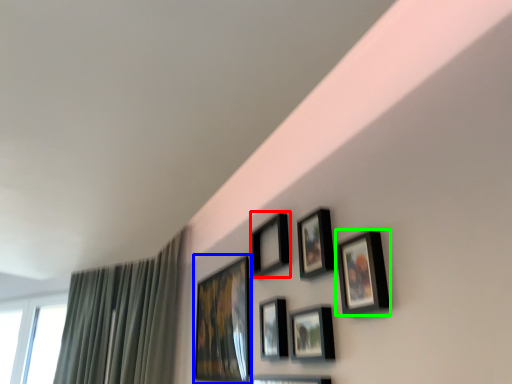
Question: Considering the real-world distances, which object is closest to picture frame (highlighted by a red box)? picture frame (highlighted by a blue box) or picture frame (highlighted by a green box).

Choices:
 (A) picture frame
 (B) picture frame

Answer: (A)